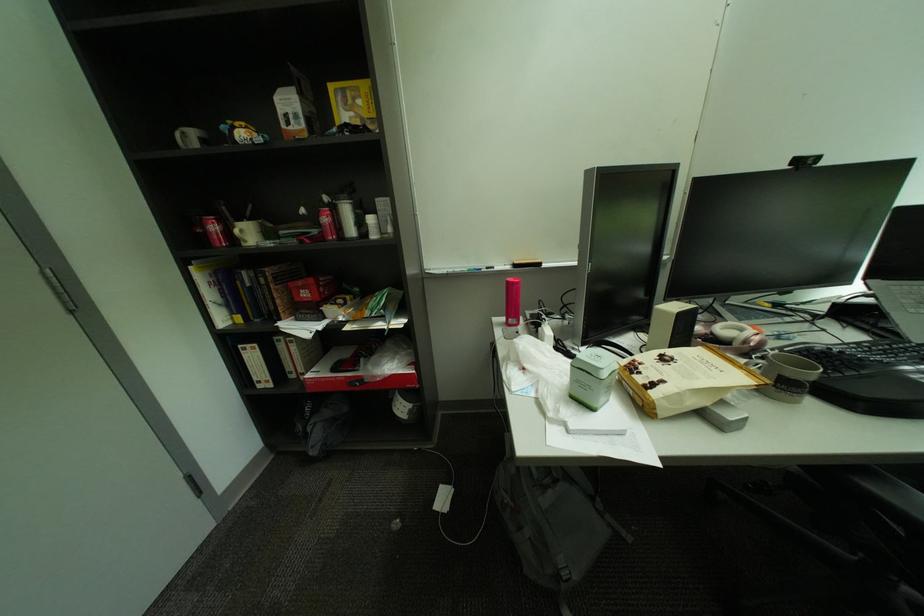
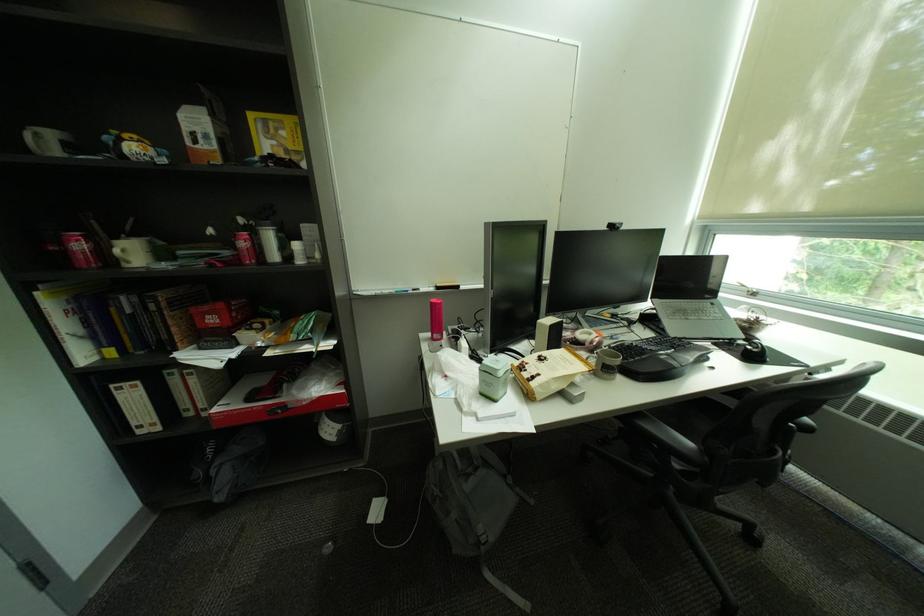
Find the pixel in the second image that matches (527,264) in the first image.

(450, 286)